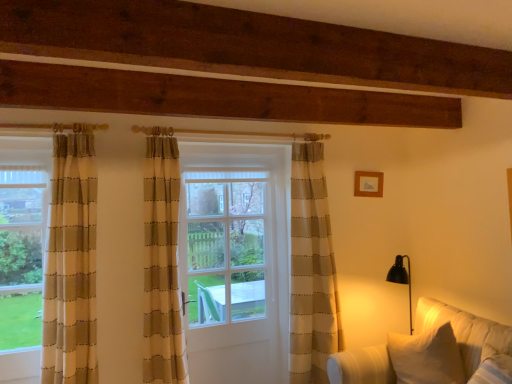
Question: Is clear glass door at center bigger or smaller than white fabric couch at lower right?

Choices:
 (A) big
 (B) small

Answer: (B)

Question: Is clear glass door at center wider or thinner than white fabric couch at lower right?

Choices:
 (A) wide
 (B) thin

Answer: (B)

Question: Which object is the closest to the white fabric couch at lower right?

Choices:
 (A) clear glass door at center
 (B) beige striped curtains at left
 (C) wooden picture frame at upper right
 (D) white wooden door at center

Answer: (D)

Question: Estimate the real-world distances between objects in this image. Which object is closer to the white wooden door at center?

Choices:
 (A) white fabric couch at lower right
 (B) wooden picture frame at upper right
 (C) clear glass door at center
 (D) beige striped curtains at left

Answer: (C)